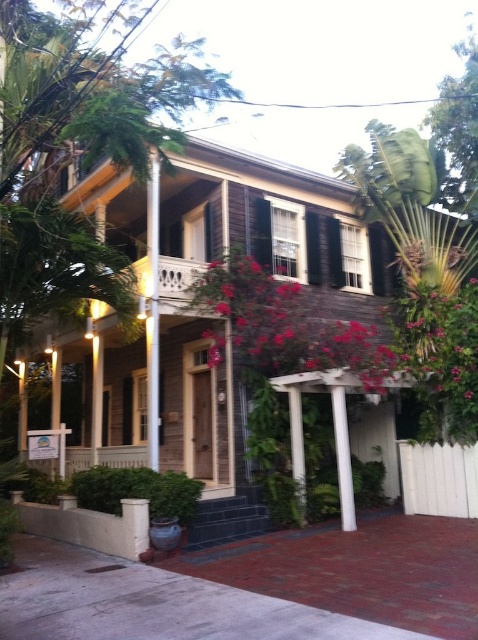
Is green leafy bush at lower center closer to the viewer compared to white smooth pillar at lower center?

Yes.

Can you confirm if green leafy bush at lower center is taller than white smooth pillar at lower center?

No.

At what (x,y) coordinates should I click in order to perform the action: click on green leafy bush at lower center. Please return your answer as a coordinate pair (x, y). Looking at the image, I should click on (138, 490).

Measure the distance between point (365, 349) and camera.

The distance of point (365, 349) from camera is 9.16 meters.

Between point (246, 256) and point (167, 481), which one is positioned in front?

Point (167, 481)

This screenshot has width=478, height=640. I want to click on pink wood flowers at center, so click(x=286, y=324).

I want to click on white painted wood column at center, so click(x=152, y=310).

Who is shorter, white painted wood column at center or white smooth column at center?

white smooth column at center

Does point (151, 332) lie in front of point (347, 481)?

No.

Where is `white painted wood column at center`? This screenshot has width=478, height=640. white painted wood column at center is located at coordinates tap(152, 310).